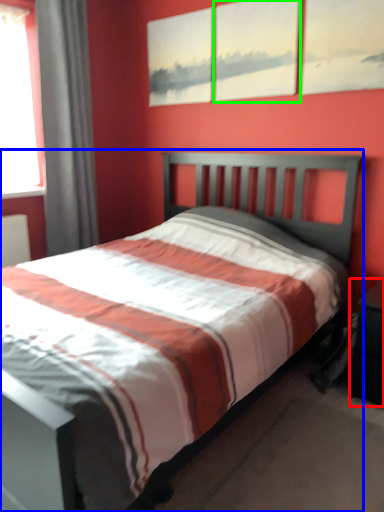
Question: Which object is the farthest from nightstand (highlighted by a red box)? Choose among these: bed (highlighted by a blue box) or picture frame (highlighted by a green box).

Choices:
 (A) bed
 (B) picture frame

Answer: (B)